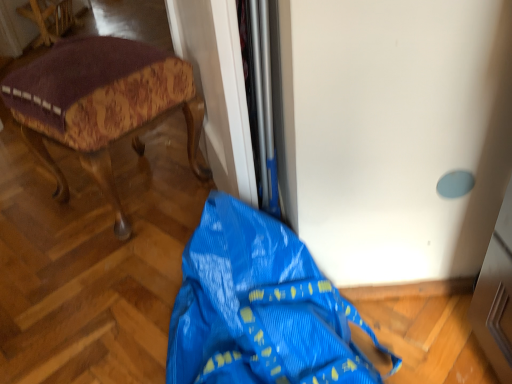
Locate an element on the screen. This screenshot has height=384, width=512. maroon fabric stool at left is located at coordinates (100, 104).

What do you see at coordinates (100, 104) in the screenshot? I see `maroon fabric stool at left` at bounding box center [100, 104].

Consider the image. What is the approximate height of maroon fabric stool at left?

It is 18.57 inches.

You are a GUI agent. You are given a task and a screenshot of the screen. Output one action in this format:
    pyautogui.click(x=<x>, y=<y>)
    Task: Click on the maroon fabric stool at left
    
    Given the screenshot: What is the action you would take?
    pyautogui.click(x=100, y=104)